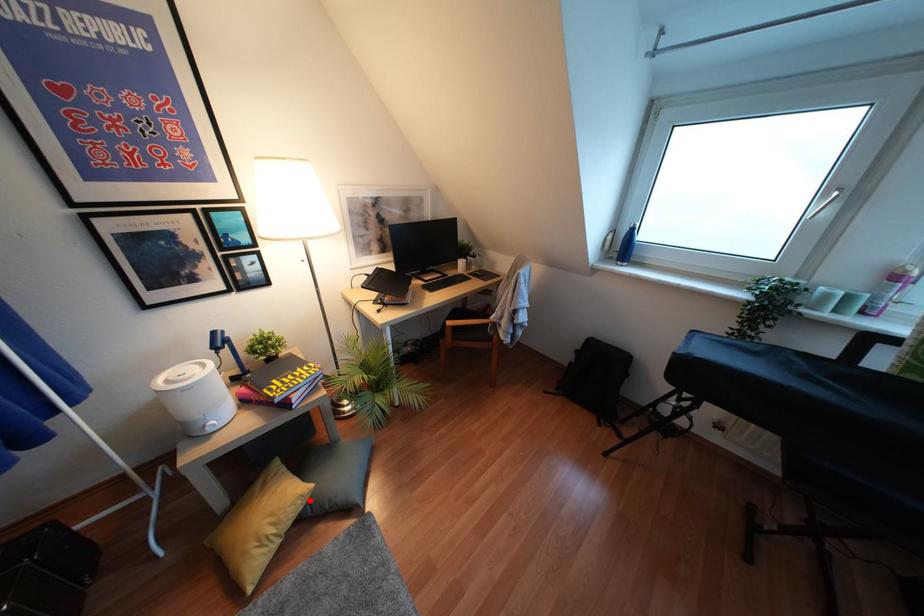
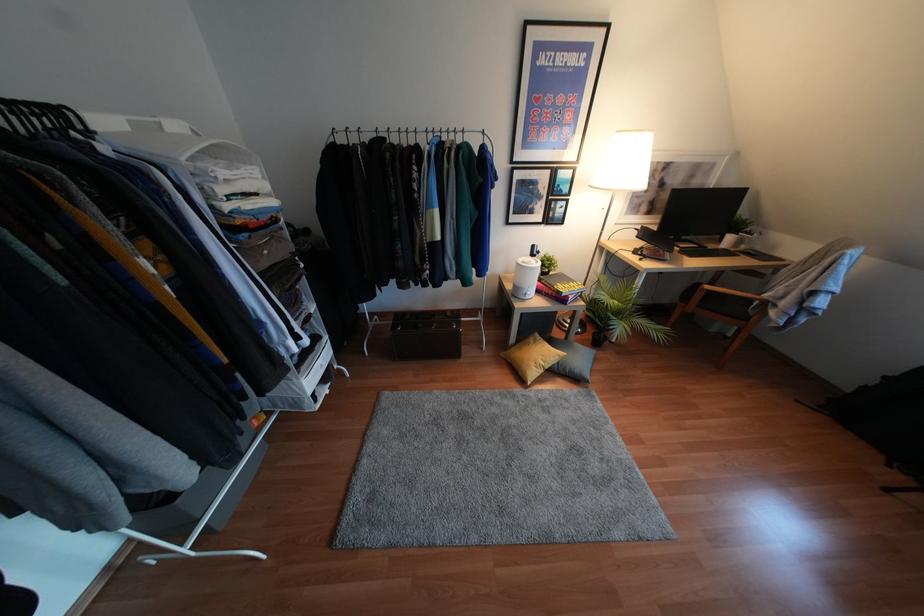
Find the pixel in the second image that matches the highlighted location in the first image.

(556, 362)